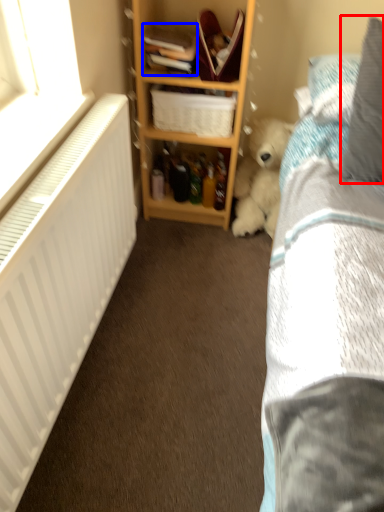
Question: Which object is closer to the camera taking this photo, pillow (highlighted by a red box) or book (highlighted by a blue box)?

Choices:
 (A) pillow
 (B) book

Answer: (A)